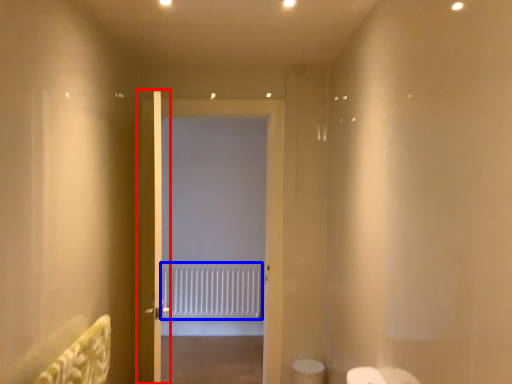
Question: Which object appears farthest to the camera in this image, door (highlighted by a red box) or radiator (highlighted by a blue box)?

Choices:
 (A) door
 (B) radiator

Answer: (B)